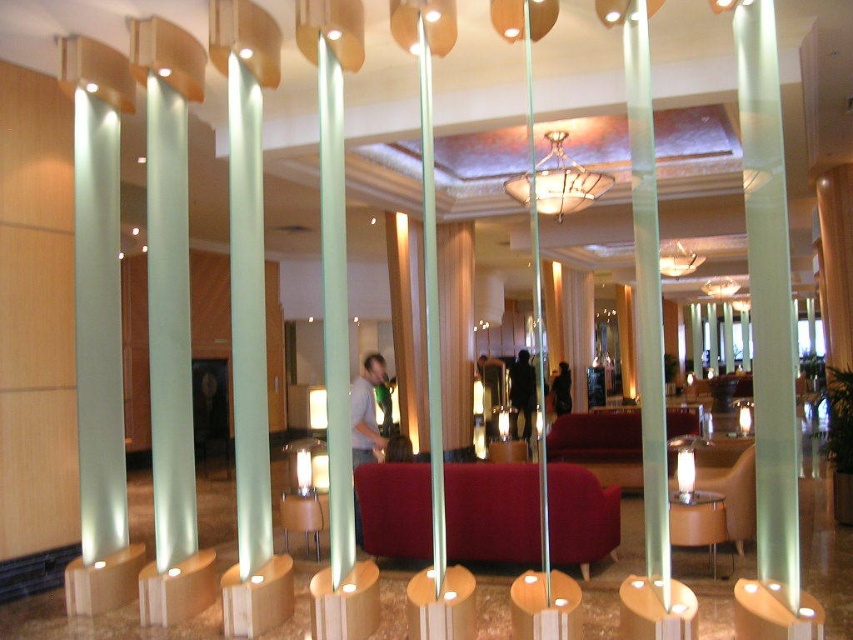
Question: Which object appears closest to the camera in this image?

Choices:
 (A) frosted glass pillar at center
 (B) matte glass chandelier at upper center
 (C) transparent glass pillar at center

Answer: (A)

Question: Which point is closer to the camera?

Choices:
 (A) coord(790,493)
 (B) coord(654,177)
 (C) coord(561,212)
 (D) coord(432,275)

Answer: (A)

Question: Does transparent glass pillar at center lie in front of matte glass chandelier at upper center?

Choices:
 (A) yes
 (B) no

Answer: (A)

Question: Which point is farther to the camera?

Choices:
 (A) (582, 200)
 (B) (775, 513)
 (C) (432, 259)
 (D) (675, 256)

Answer: (D)

Question: Does transparent glass pillar at center appear under matte glass chandelier at center?

Choices:
 (A) yes
 (B) no

Answer: (A)

Question: Is frosted glass pillar at center to the left of matte glass chandelier at upper center from the viewer's perspective?

Choices:
 (A) no
 (B) yes

Answer: (B)